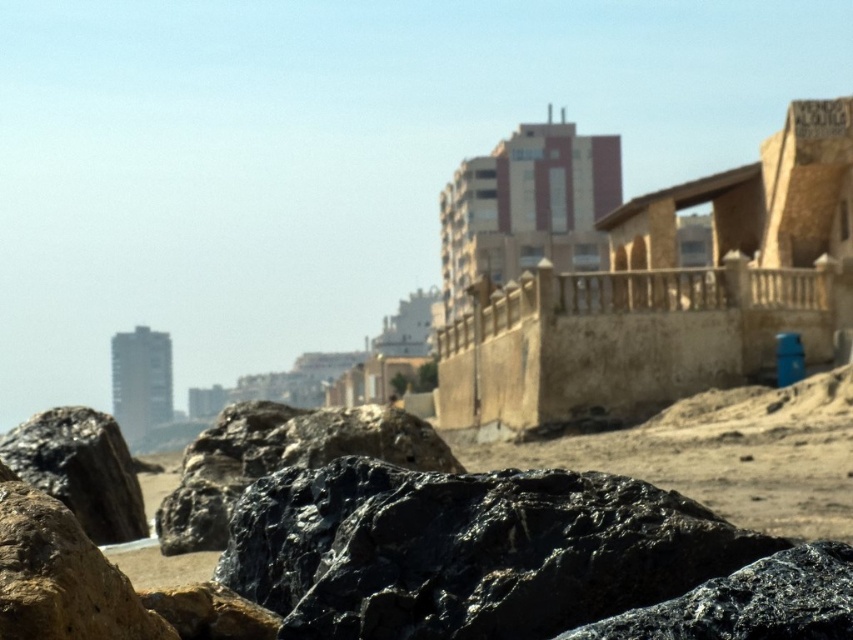
Question: Which point is farther to the camera?

Choices:
 (A) (648, 518)
 (B) (49, 433)

Answer: (B)

Question: Is shiny black rock at lower left closer to camera compared to black rough rock at lower left?

Choices:
 (A) yes
 (B) no

Answer: (A)

Question: Among these objects, which one is farthest from the camera?

Choices:
 (A) shiny black rock at lower left
 (B) black rough rock at lower left

Answer: (B)

Question: Which object is closer to the camera taking this photo?

Choices:
 (A) shiny black rock at lower left
 (B) black rough rock at lower left

Answer: (A)

Question: Does shiny black rock at lower left appear on the left side of black rough rock at lower left?

Choices:
 (A) no
 (B) yes

Answer: (A)

Question: In this image, where is shiny black rock at lower left located relative to black rough rock at lower left?

Choices:
 (A) below
 (B) above

Answer: (A)